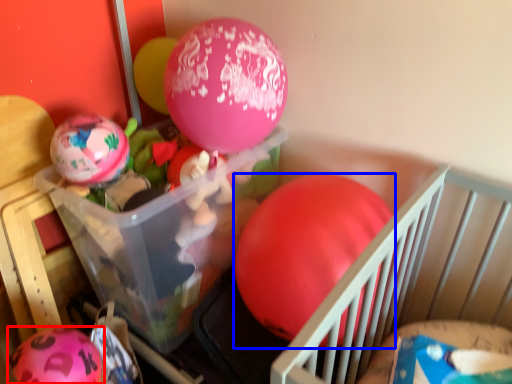
Question: Among these objects, which one is nearest to the camera, balloon (highlighted by a red box) or balloon (highlighted by a blue box)?

Choices:
 (A) balloon
 (B) balloon

Answer: (B)